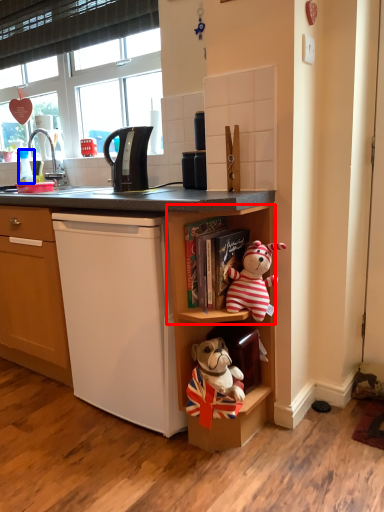
Question: Which object appears farthest to the camera in this image, shelf (highlighted by a red box) or coffee cup (highlighted by a blue box)?

Choices:
 (A) shelf
 (B) coffee cup

Answer: (B)